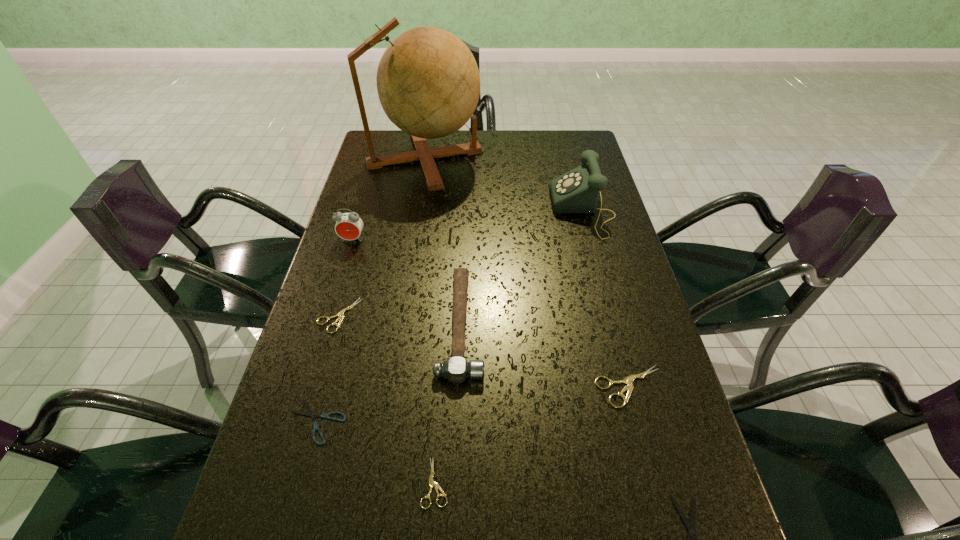
You are a GUI agent. You are given a task and a screenshot of the screen. Output one action in this format:
    pyautogui.click(x=<x>, y=<y>)
    Task: Click on the tallest object
    Image resolution: width=960 pixels, height=540 pixels.
    Given the screenshot: What is the action you would take?
    pyautogui.click(x=428, y=82)

At what (x,y) coordinates should I click in order to perform the action: click on the second tallest object. Please return your answer as a coordinate pair (x, y). This screenshot has height=540, width=960. Looking at the image, I should click on (577, 191).

Locate an element on the screen. The height and width of the screenshot is (540, 960). red alarm clock is located at coordinates (348, 226).

Locate an element on the screen. alarm clock is located at coordinates (348, 226).

Find the location of `hammer`. hammer is located at coordinates tap(456, 369).

Image resolution: width=960 pixels, height=540 pixels. In order to click on the biggest beige shears in this screenshot , I will do `click(628, 380)`.

Identify the location of the fifth shortest object. (628, 380).

Locate an element on the screen. The image size is (960, 540). the leftmost beige shears is located at coordinates (340, 315).

Locate an element on the screen. This screenshot has height=540, width=960. the farthest shears is located at coordinates (340, 315).

Find the location of a particular element. the second beige shears from right to left is located at coordinates (432, 484).